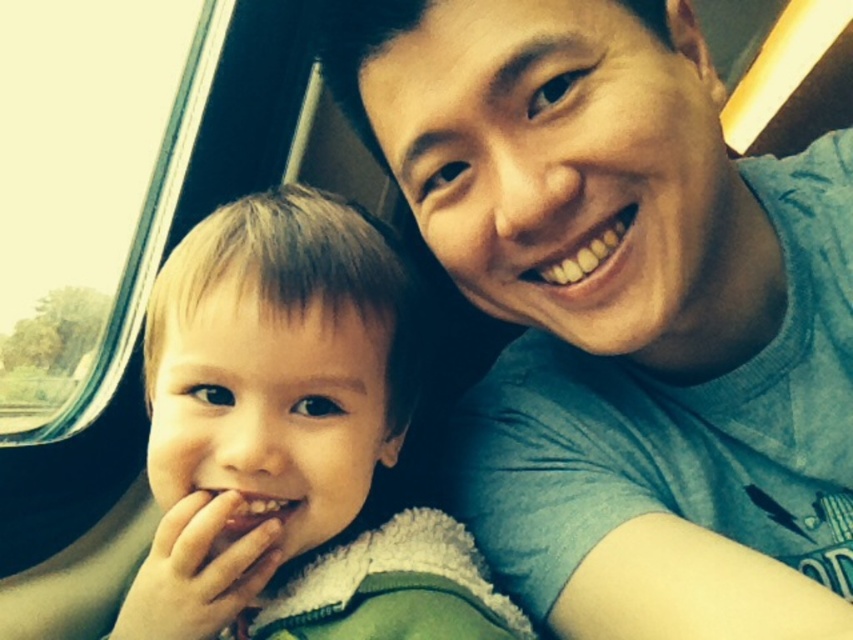
Question: Considering the relative positions of blue cotton shirt at upper right and light brown fuzzy jacket at left in the image provided, where is blue cotton shirt at upper right located with respect to light brown fuzzy jacket at left?

Choices:
 (A) above
 (B) below

Answer: (A)

Question: Can you confirm if blue cotton shirt at upper right is smaller than light brown fuzzy jacket at left?

Choices:
 (A) no
 (B) yes

Answer: (A)

Question: Does blue cotton shirt at upper right have a greater width compared to light brown fuzzy jacket at left?

Choices:
 (A) no
 (B) yes

Answer: (B)